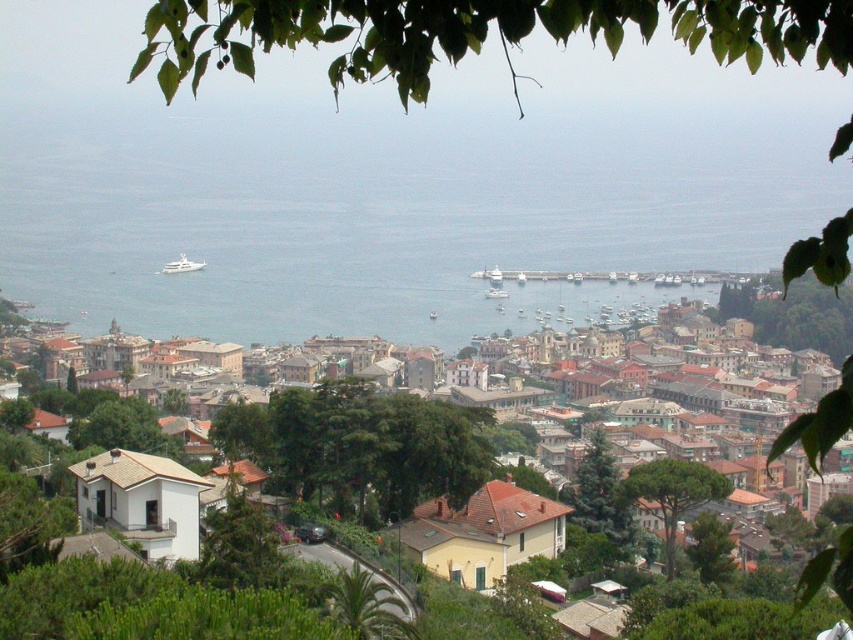
Is blue water at center wider than green leafy tree at center-right?

Indeed, blue water at center has a greater width compared to green leafy tree at center-right.

Is blue water at center positioned behind green leafy tree at center-right?

That is False.

Describe the element at coordinates (386, 218) in the screenshot. This screenshot has width=853, height=640. I see `blue water at center` at that location.

This screenshot has height=640, width=853. I want to click on blue water at center, so click(386, 218).

This screenshot has height=640, width=853. Describe the element at coordinates (360, 444) in the screenshot. I see `green leafy tree at center` at that location.

Is green leafy tree at center bigger than green rough bark tree at lower right?

Yes.

Where is `green leafy tree at center`? The height and width of the screenshot is (640, 853). green leafy tree at center is located at coordinates (360, 444).

In the scene shown: Who is shorter, green leafy tree at upper center or white matte building at center?

white matte building at center

Does green leafy tree at upper center appear on the left side of white matte building at center?

No, green leafy tree at upper center is not to the left of white matte building at center.

Locate an element on the screen. Image resolution: width=853 pixels, height=640 pixels. green leafy tree at upper center is located at coordinates (474, 33).